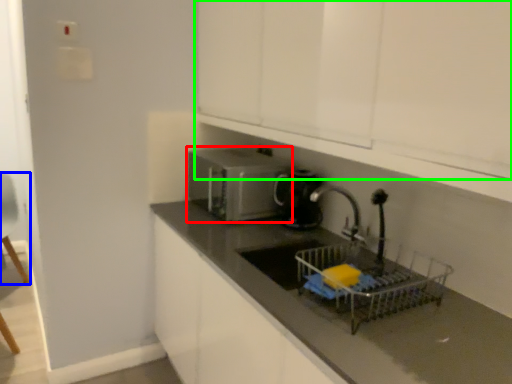
Question: Which object is positioned farthest from home appliance (highlighted by a red box)? Select from armchair (highlighted by a blue box) and cabinetry (highlighted by a green box).

Choices:
 (A) armchair
 (B) cabinetry

Answer: (A)